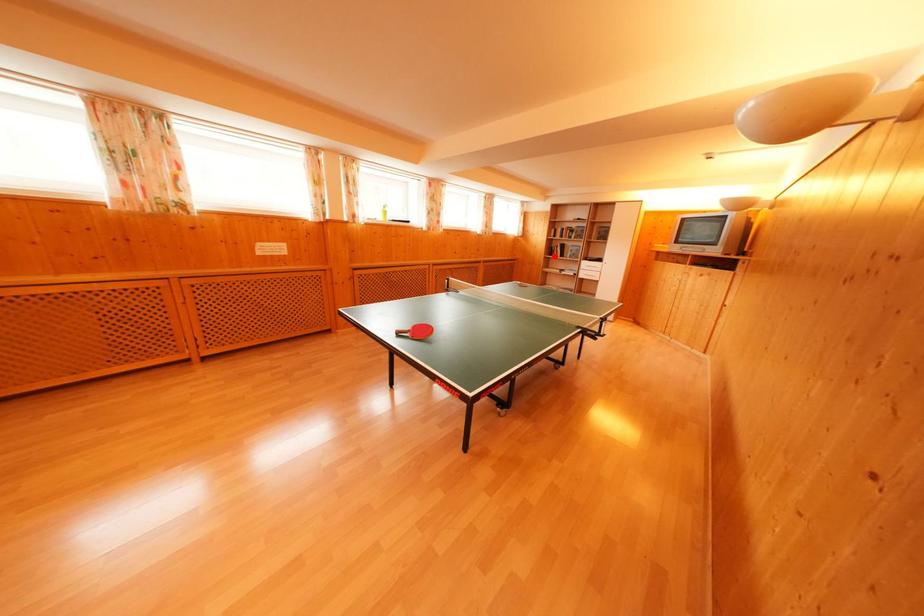
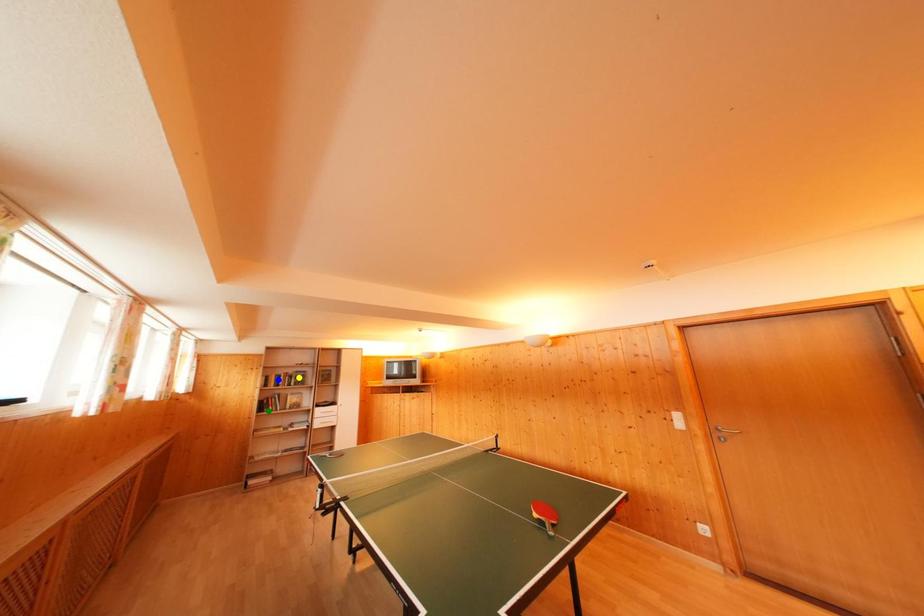
Question: I am providing you with two images of the same scene from different viewpoints. A red point is marked on the first image. You are given multiple points on the second image. In image 2, which mark is for the same physical point as the one in image 1?

Choices:
 (A) green point
 (B) blue point
 (C) yellow point

Answer: (A)